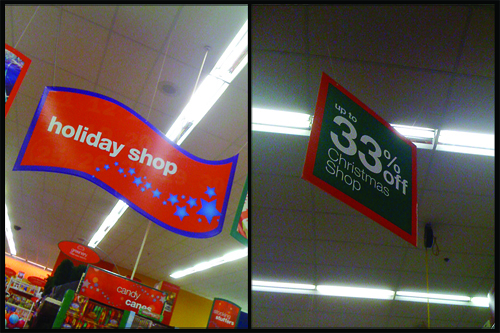
Where is `shelf`? shelf is located at coordinates (18, 301).